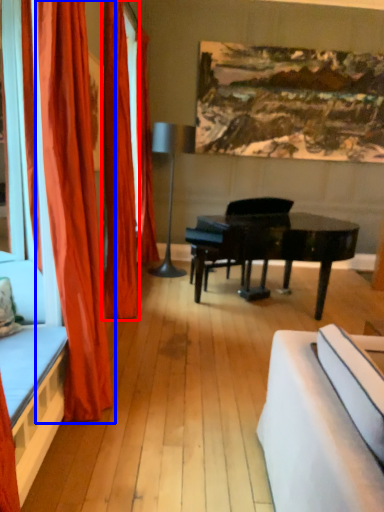
Question: Which of the following is the closest to the observer, curtain (highlighted by a red box) or curtain (highlighted by a blue box)?

Choices:
 (A) curtain
 (B) curtain

Answer: (B)